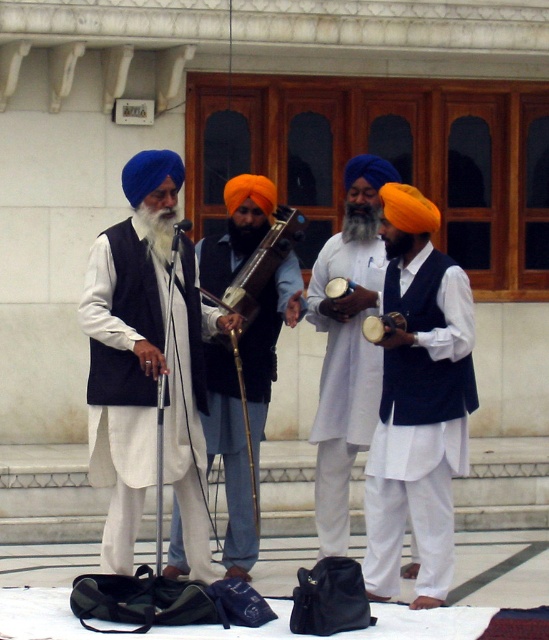
Question: Is matte black turban at center wider than matte wood drum at center?

Choices:
 (A) yes
 (B) no

Answer: (A)

Question: Which is nearer to the wooden polished instrument at center?

Choices:
 (A) matte black vest at center
 (B) white cotton drum at center

Answer: (A)

Question: Estimate the real-world distances between objects in this image. Which object is farther from the wooden polished instrument at center?

Choices:
 (A) matte wood drum at center
 (B) white cotton drum at center
 (C) matte black vest at center
 (D) matte black turban at center

Answer: (B)

Question: In this image, where is matte black vest at center located relative to matte black turban at center?

Choices:
 (A) left
 (B) right

Answer: (A)

Question: Does matte black vest at center appear under matte black turban at center?

Choices:
 (A) no
 (B) yes

Answer: (A)

Question: Which object appears closest to the camera in this image?

Choices:
 (A) matte black vest at center
 (B) matte black turban at center
 (C) white cotton drum at center

Answer: (C)